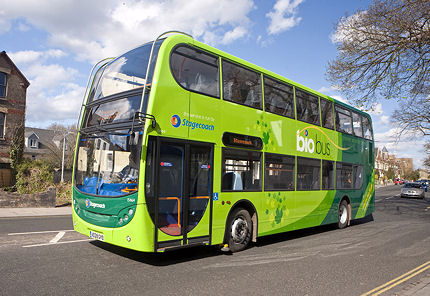
Identify the location of 1 set of doors. The height and width of the screenshot is (296, 430). (187, 200).